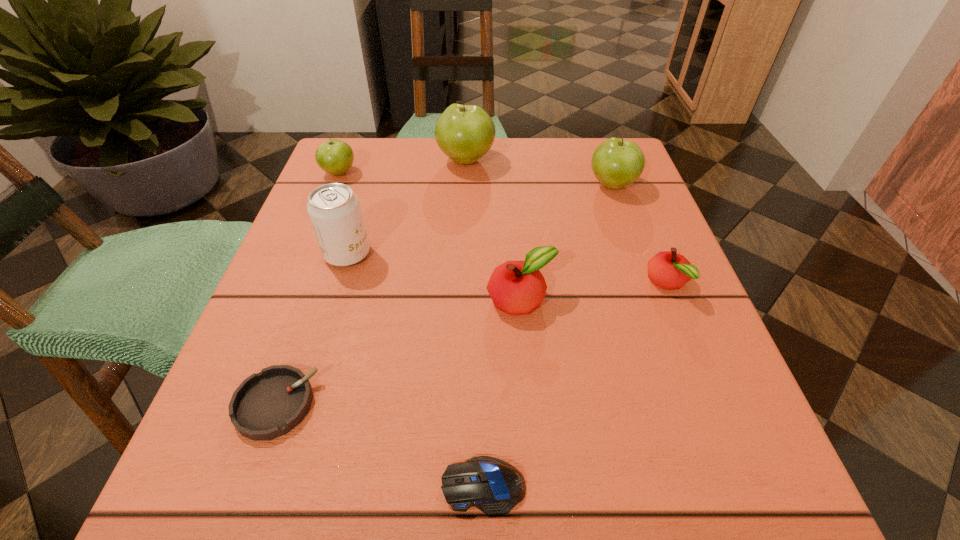
Locate an element on the screen. The width and height of the screenshot is (960, 540). vacant point that satisfies the following two spatial constraints: 1. on the back side of the second smallest green apple; 2. on the right side of the soda can is located at coordinates (369, 185).